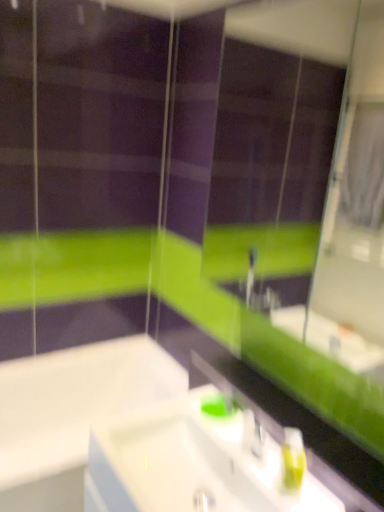
Question: Does white glossy bathtub at lower left come behind green matte mirror at upper center?

Choices:
 (A) yes
 (B) no

Answer: (A)

Question: Is white glossy bathtub at lower left shorter than green matte mirror at upper center?

Choices:
 (A) no
 (B) yes

Answer: (B)

Question: Considering the relative sizes of white glossy bathtub at lower left and green matte mirror at upper center in the image provided, is white glossy bathtub at lower left wider than green matte mirror at upper center?

Choices:
 (A) no
 (B) yes

Answer: (B)

Question: Is white glossy bathtub at lower left oriented towards green matte mirror at upper center?

Choices:
 (A) yes
 (B) no

Answer: (B)

Question: Does white glossy bathtub at lower left have a larger size compared to green matte mirror at upper center?

Choices:
 (A) no
 (B) yes

Answer: (B)

Question: Is white glossy bathtub at lower left placed right next to green matte mirror at upper center?

Choices:
 (A) yes
 (B) no

Answer: (B)

Question: Is white glossy sink at center positioned before green matte soap dispenser at lower right?

Choices:
 (A) no
 (B) yes

Answer: (B)

Question: Can we say white glossy sink at center lies outside green matte soap dispenser at lower right?

Choices:
 (A) no
 (B) yes

Answer: (B)

Question: Does white glossy sink at center have a larger size compared to green matte soap dispenser at lower right?

Choices:
 (A) no
 (B) yes

Answer: (B)

Question: Does white glossy sink at center have a greater height compared to green matte soap dispenser at lower right?

Choices:
 (A) yes
 (B) no

Answer: (B)

Question: Is white glossy sink at center oriented towards green matte soap dispenser at lower right?

Choices:
 (A) no
 (B) yes

Answer: (A)

Question: Does white glossy sink at center appear on the left side of green matte soap dispenser at lower right?

Choices:
 (A) yes
 (B) no

Answer: (A)

Question: Considering the relative positions of green matte mirror at upper center and white glossy sink at center in the image provided, is green matte mirror at upper center to the left of white glossy sink at center from the viewer's perspective?

Choices:
 (A) yes
 (B) no

Answer: (B)